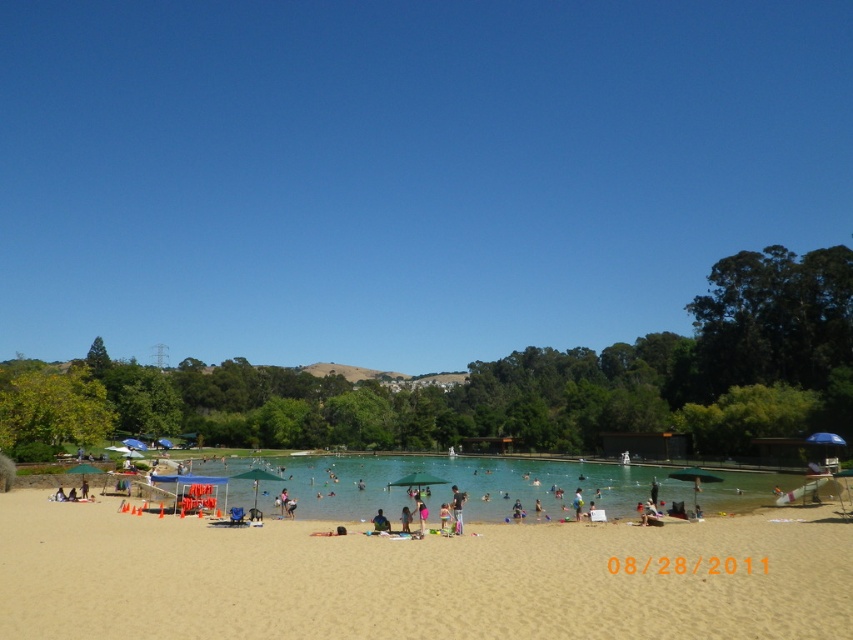
Question: Which object is positioned closest to the fine-grained sand at center?

Choices:
 (A) transparent blue sky at upper center
 (B) light brown wooden chair at center
 (C) clear blue water at center

Answer: (B)

Question: Can you confirm if fine-grained sand at center is positioned above clear blue water at center?

Choices:
 (A) yes
 (B) no

Answer: (A)

Question: Which of the following is the closest to the observer?

Choices:
 (A) (608, 248)
 (B) (386, 524)

Answer: (B)

Question: Considering the real-world distances, which object is farthest from the clear blue water at center?

Choices:
 (A) light brown wooden chair at center
 (B) transparent blue sky at upper center
 (C) fine-grained sand at center

Answer: (B)

Question: Does clear blue water at center have a greater width compared to light brown wooden chair at center?

Choices:
 (A) no
 (B) yes

Answer: (B)

Question: Can you confirm if transparent blue sky at upper center is positioned to the left of light brown wooden chair at center?

Choices:
 (A) yes
 (B) no

Answer: (A)